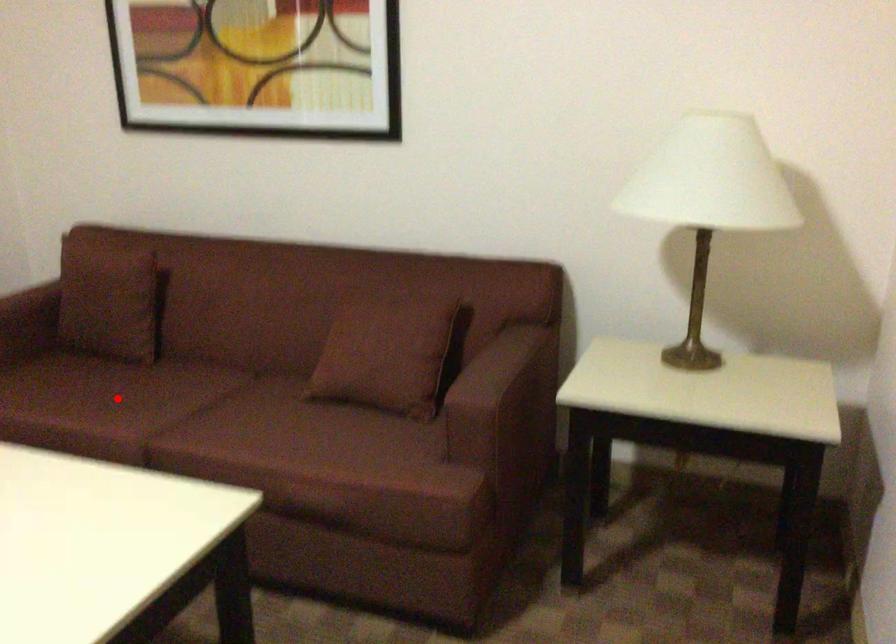
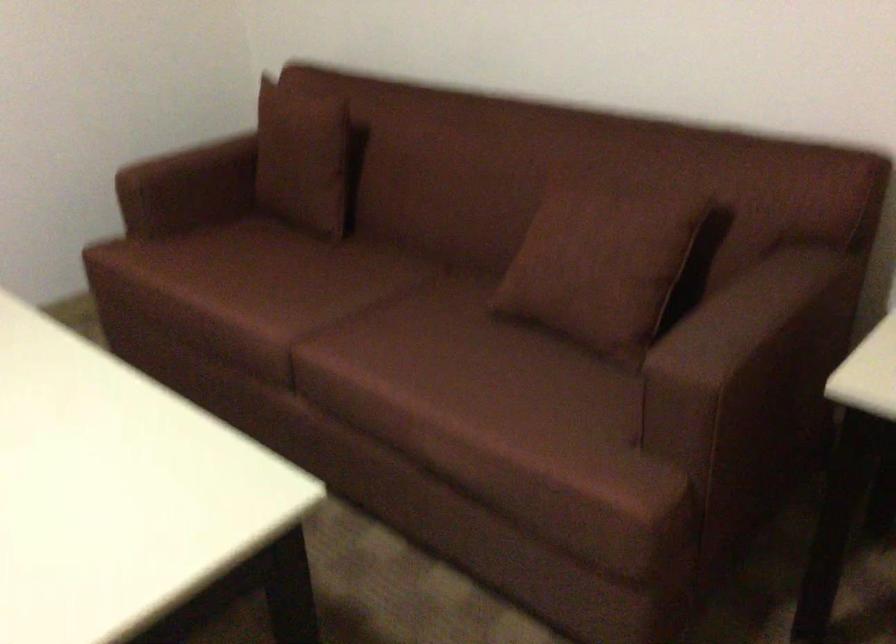
In the second image, find the point that corresponds to the highlighted location in the first image.

(286, 283)